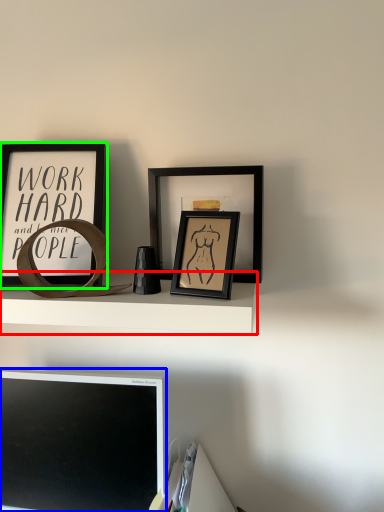
Question: Estimate the real-world distances between objects in this image. Which object is closer to shelf (highlighted by a red box), computer monitor (highlighted by a blue box) or picture frame (highlighted by a green box)?

Choices:
 (A) computer monitor
 (B) picture frame

Answer: (B)